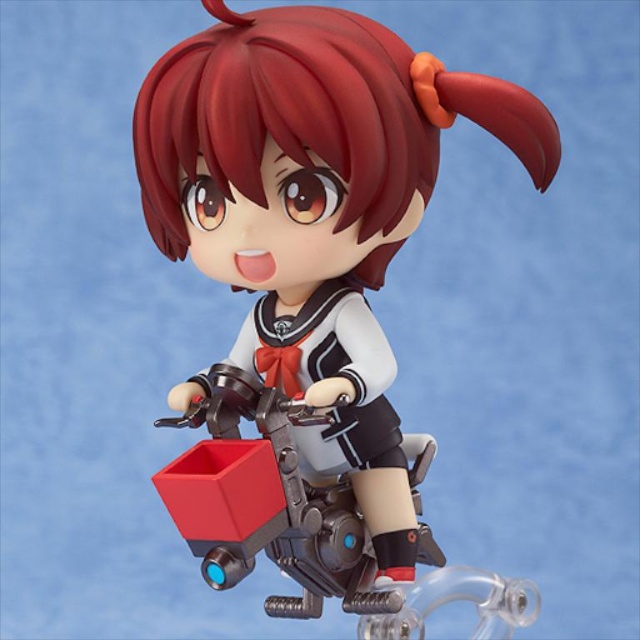
Question: Which of the following is the farthest from the observer?

Choices:
 (A) (554, 140)
 (B) (380, 227)

Answer: (A)

Question: Does matte black figure at center have a lesser width compared to satin red hair at center?

Choices:
 (A) no
 (B) yes

Answer: (A)

Question: Is matte black figure at center to the right of satin red hair at center from the viewer's perspective?

Choices:
 (A) yes
 (B) no

Answer: (A)

Question: Which of the following is the farthest from the observer?

Choices:
 (A) matte black figure at center
 (B) satin red hair at center

Answer: (B)

Question: Does matte black figure at center lie behind satin red hair at center?

Choices:
 (A) no
 (B) yes

Answer: (A)

Question: Which point is closer to the camera?

Choices:
 (A) (468, 586)
 (B) (262, 84)

Answer: (B)